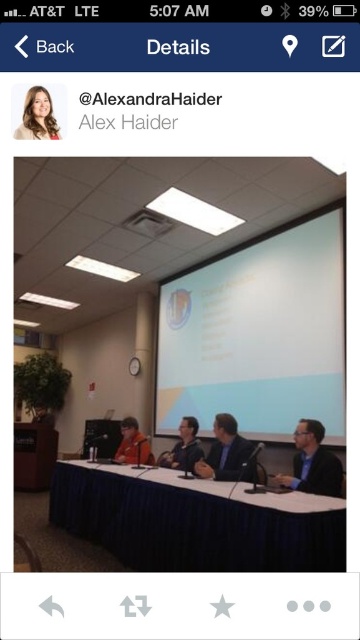
Can you confirm if dark blue suit at center is smaller than light brown hair at upper left?

Actually, dark blue suit at center might be larger than light brown hair at upper left.

In the scene shown: Can you confirm if dark blue suit at center is positioned to the left of light brown hair at upper left?

No, dark blue suit at center is not to the left of light brown hair at upper left.

Who is more forward, (201, 476) or (42, 122)?

Point (42, 122) is more forward.

This screenshot has width=360, height=640. Identify the location of dark blue suit at center. (225, 451).

Is white glossy projection screen at upper center wider than matte orange shirt at center?

Yes, white glossy projection screen at upper center is wider than matte orange shirt at center.

Can you confirm if white glossy projection screen at upper center is shorter than matte orange shirt at center?

In fact, white glossy projection screen at upper center may be taller than matte orange shirt at center.

Describe the element at coordinates (258, 333) in the screenshot. The image size is (360, 640). I see `white glossy projection screen at upper center` at that location.

The height and width of the screenshot is (640, 360). In order to click on white glossy projection screen at upper center in this screenshot , I will do `click(258, 333)`.

Who is more forward, (191, 301) or (209, 454)?

Point (209, 454) is more forward.

Between white glossy projection screen at upper center and dark blue suit at center, which one has more height?

white glossy projection screen at upper center

Is point (294, 241) positioned in front of point (227, 442)?

No, (294, 241) is further to viewer.

This screenshot has width=360, height=640. Identify the location of white glossy projection screen at upper center. (258, 333).